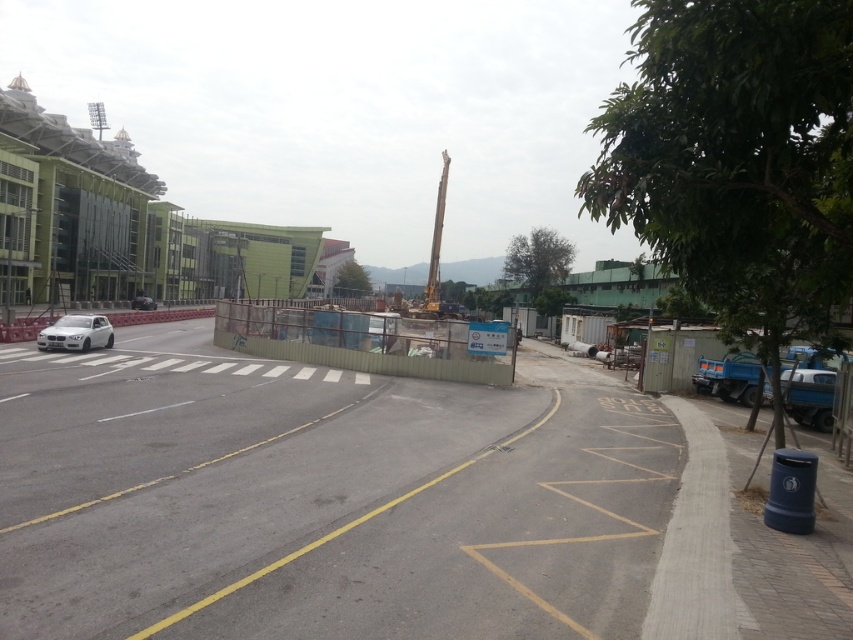
Question: In this image, where is sleek silver sedan at left located relative to satin silver sedan at left?

Choices:
 (A) right
 (B) left

Answer: (A)

Question: Among these objects, which one is farthest from the camera?

Choices:
 (A) metallic yellow crane at center
 (B) metal fence at center

Answer: (A)

Question: Does metal fence at center appear over metallic yellow crane at center?

Choices:
 (A) yes
 (B) no

Answer: (B)

Question: Which object is farther from the camera taking this photo?

Choices:
 (A) satin silver sedan at left
 (B) sleek silver sedan at left
 (C) metal fence at center
 (D) metallic yellow crane at center

Answer: (A)

Question: Is sleek silver sedan at left closer to the viewer compared to satin silver sedan at left?

Choices:
 (A) yes
 (B) no

Answer: (A)

Question: Which object is the farthest from the sleek silver sedan at left?

Choices:
 (A) metallic yellow crane at center
 (B) satin silver sedan at left

Answer: (A)